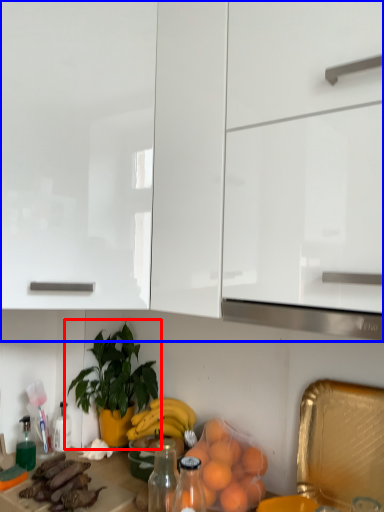
Question: Which object is closer to the camera taking this photo, houseplant (highlighted by a red box) or cabinetry (highlighted by a blue box)?

Choices:
 (A) houseplant
 (B) cabinetry

Answer: (B)